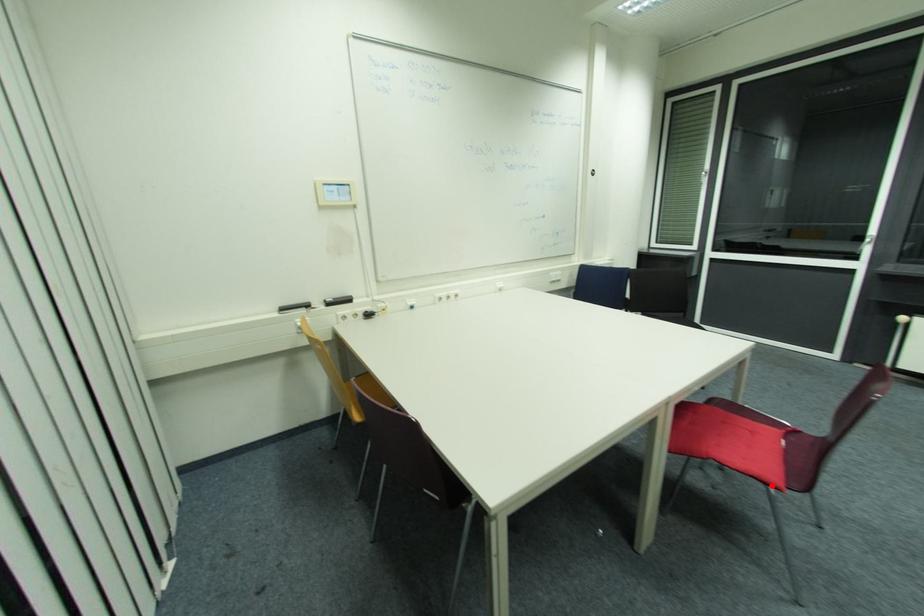
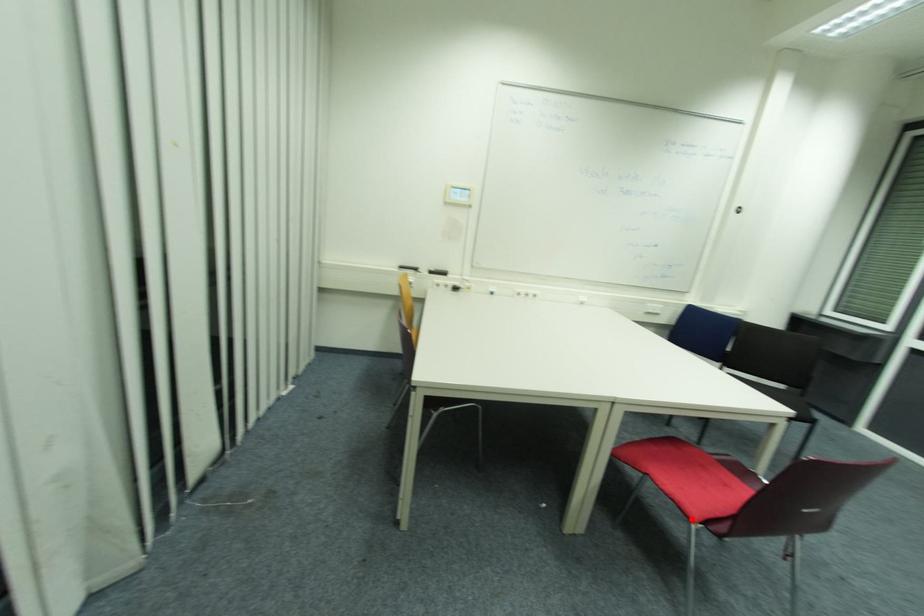
I am providing you with two images of the same scene from different viewpoints. A red point is marked on the first image and another point is marked on the second image. Is the marked point in image1 the same physical position as the marked point in image2?

Yes